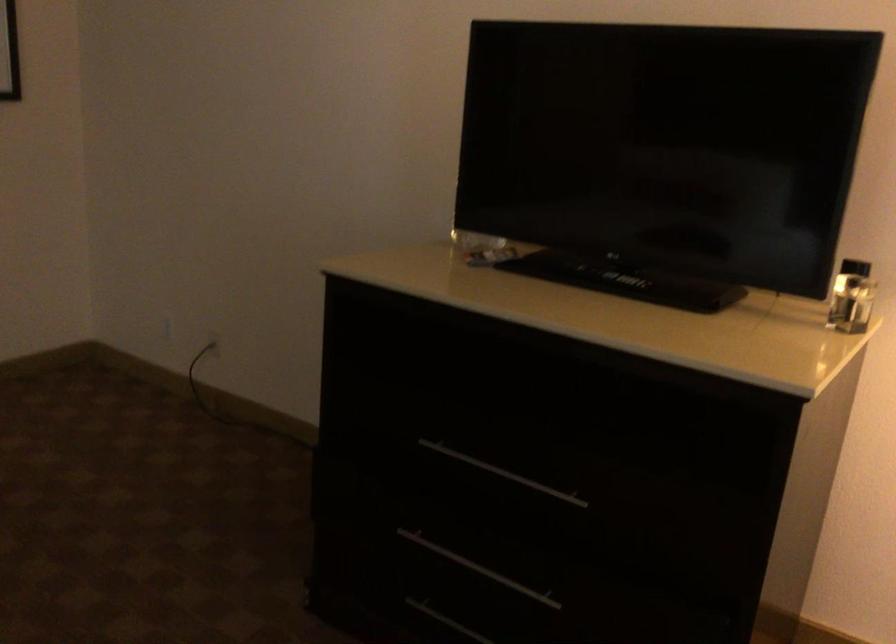
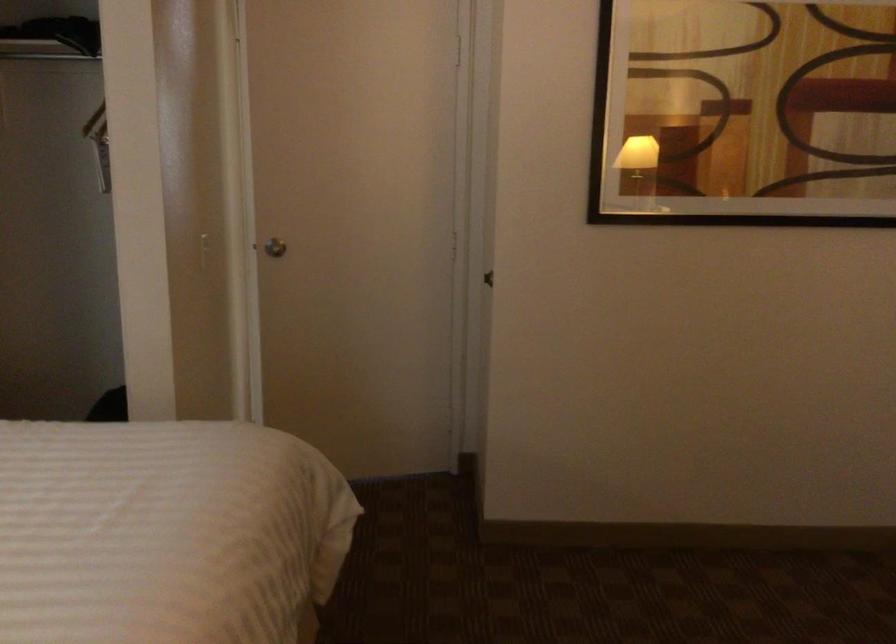
Question: Based on the continuous images, in which direction is the camera rotating? Reply with the corresponding letter.

Choices:
 (A) Left
 (B) Right
 (C) Up
 (D) Down

Answer: (A)